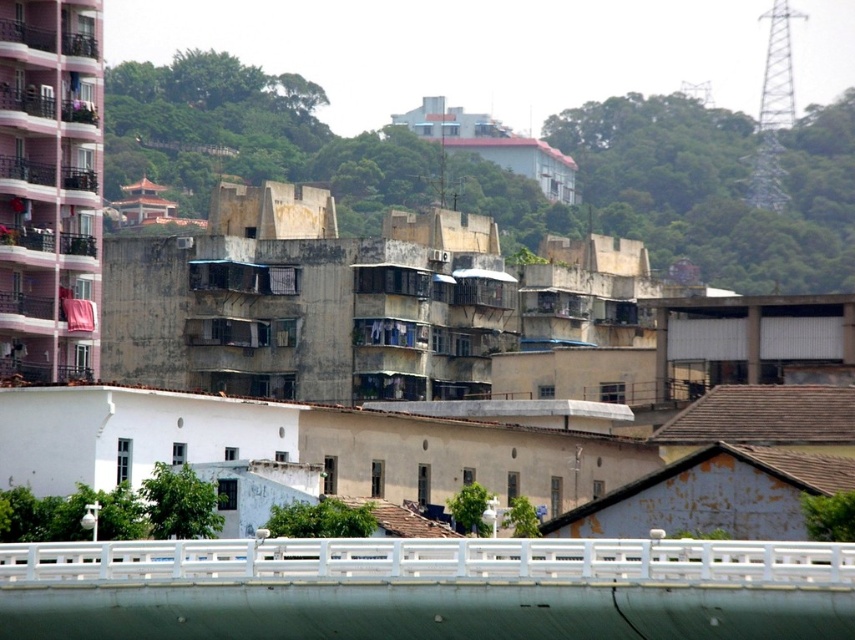
Can you confirm if white concrete bridge at lower center is smaller than white matte overpass at right?

Indeed, white concrete bridge at lower center has a smaller size compared to white matte overpass at right.

Identify the location of white concrete bridge at lower center. (428, 589).